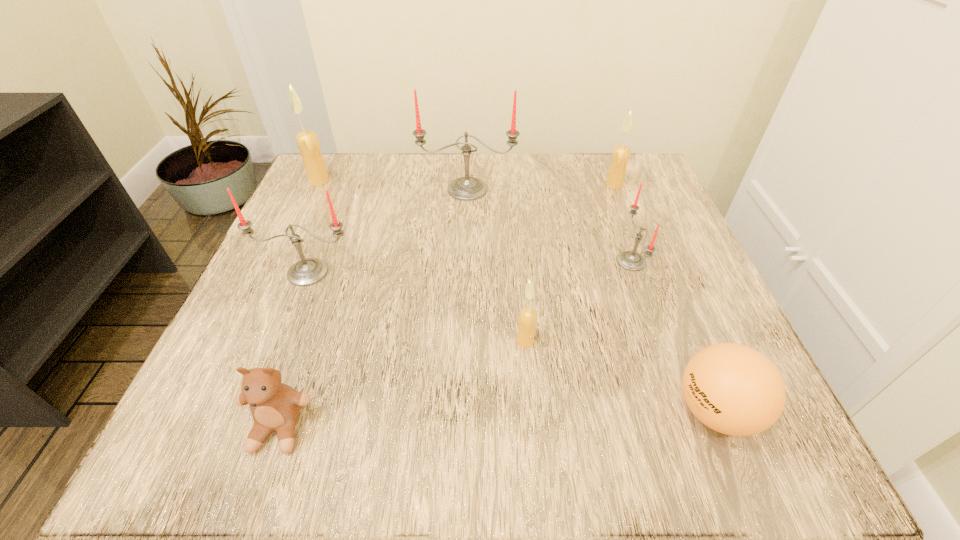
You are a GUI agent. You are given a task and a screenshot of the screen. Output one action in this format:
    pyautogui.click(x=<x>, y=<y>)
    Task: Click on the biggest red candle
    
    Given the screenshot: What is the action you would take?
    pyautogui.click(x=466, y=188)

At what (x,y) coordinates should I click in order to perform the action: click on the farthest red candle. Please return your answer as a coordinate pair (x, y). The height and width of the screenshot is (540, 960). Looking at the image, I should click on (466, 188).

Identify the location of the biggest cream candle. (307, 141).

Find the location of `the rightmost cream candle`. the rightmost cream candle is located at coordinates (621, 153).

Where is `the second smallest red candle`? This screenshot has height=540, width=960. the second smallest red candle is located at coordinates (309, 271).

Locate an element on the screen. the rightmost red candle is located at coordinates (630, 260).

I want to click on the smallest cream candle, so click(527, 320).

Image resolution: width=960 pixels, height=540 pixels. Identify the location of the second cream candle from right to left. pyautogui.click(x=527, y=320).

I want to click on ping-pong ball, so click(x=731, y=388).

This screenshot has width=960, height=540. I want to click on teddy bear, so click(x=275, y=406).